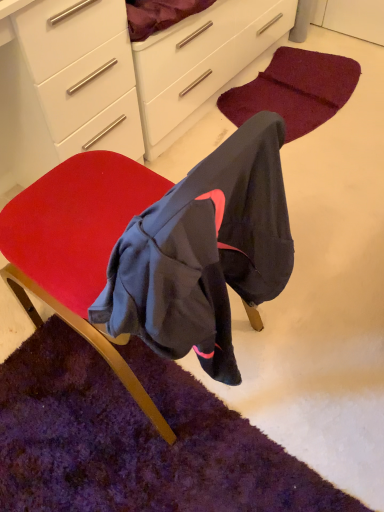
Question: Considering the relative positions of white glossy cabinet at upper center and white glossy chest of drawers at upper left in the image provided, is white glossy cabinet at upper center in front of white glossy chest of drawers at upper left?

Choices:
 (A) yes
 (B) no

Answer: (B)

Question: Is white glossy cabinet at upper center touching white glossy chest of drawers at upper left?

Choices:
 (A) yes
 (B) no

Answer: (A)

Question: From the image's perspective, would you say white glossy cabinet at upper center is positioned over white glossy chest of drawers at upper left?

Choices:
 (A) yes
 (B) no

Answer: (A)

Question: Can you confirm if white glossy cabinet at upper center is smaller than white glossy chest of drawers at upper left?

Choices:
 (A) no
 (B) yes

Answer: (B)

Question: From the image's perspective, is white glossy cabinet at upper center below white glossy chest of drawers at upper left?

Choices:
 (A) no
 (B) yes

Answer: (A)

Question: Would you say velvet red chair at center is to the left or to the right of white glossy chest of drawers at upper left in the picture?

Choices:
 (A) right
 (B) left

Answer: (A)

Question: Is velvet red chair at center in front of or behind white glossy chest of drawers at upper left in the image?

Choices:
 (A) front
 (B) behind

Answer: (A)

Question: From a real-world perspective, relative to white glossy chest of drawers at upper left, is velvet red chair at center vertically above or below?

Choices:
 (A) below
 (B) above

Answer: (B)

Question: From the image's perspective, is velvet red chair at center located above or below white glossy chest of drawers at upper left?

Choices:
 (A) below
 (B) above

Answer: (A)

Question: Considering the relative positions of velvet red chair at center and burgundy carpet at lower center, which is counted as the 1th mat, starting from the back, in the image provided, is velvet red chair at center to the left or to the right of burgundy carpet at lower center, which is counted as the 1th mat, starting from the back,?

Choices:
 (A) left
 (B) right

Answer: (A)

Question: Considering the positions of velvet red chair at center and burgundy carpet at lower center, arranged as the first mat when viewed from the top, in the image, is velvet red chair at center wider or thinner than burgundy carpet at lower center, arranged as the first mat when viewed from the top,?

Choices:
 (A) thin
 (B) wide

Answer: (B)

Question: Is velvet red chair at center taller or shorter than burgundy carpet at lower center, the 2th mat from the bottom?

Choices:
 (A) short
 (B) tall

Answer: (B)

Question: From the image's perspective, is velvet red chair at center located above or below burgundy carpet at lower center, the 2th mat from the bottom?

Choices:
 (A) above
 (B) below

Answer: (B)

Question: From the image's perspective, is burgundy carpet at lower center, which is counted as the 1th mat, starting from the back, positioned above or below purple shaggy rug at lower left, which is the 2th mat in back-to-front order?

Choices:
 (A) below
 (B) above

Answer: (B)

Question: Considering the positions of burgundy carpet at lower center, arranged as the first mat when viewed from the top, and purple shaggy rug at lower left, which is the 2th mat in back-to-front order, in the image, is burgundy carpet at lower center, arranged as the first mat when viewed from the top, wider or thinner than purple shaggy rug at lower left, which is the 2th mat in back-to-front order,?

Choices:
 (A) wide
 (B) thin

Answer: (B)